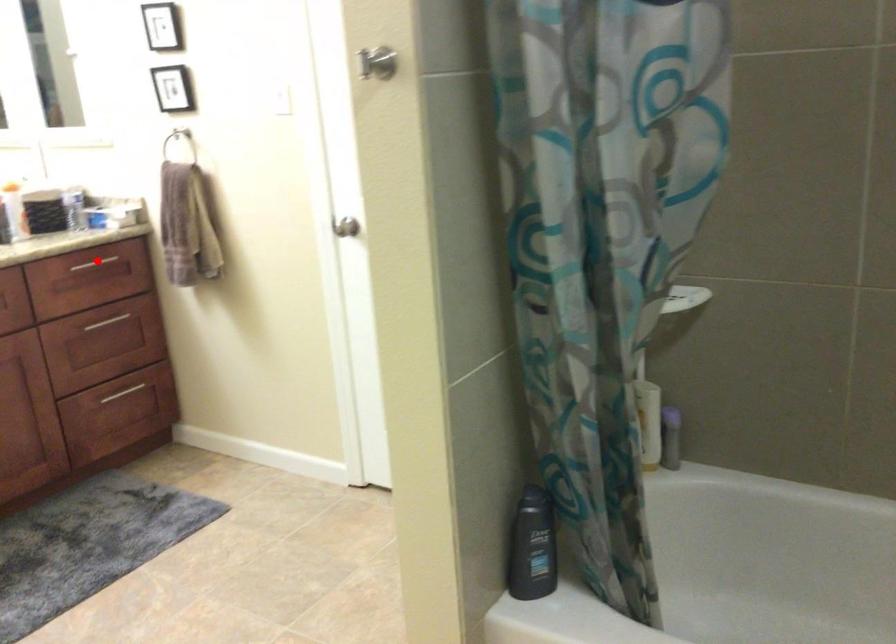
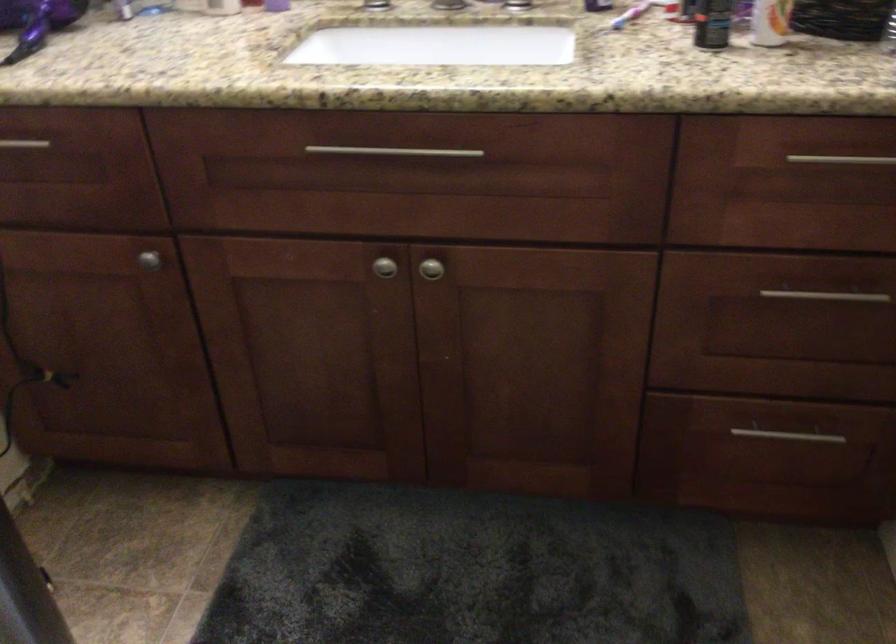
In the second image, find the point that corresponds to the highlighted location in the first image.

(841, 158)